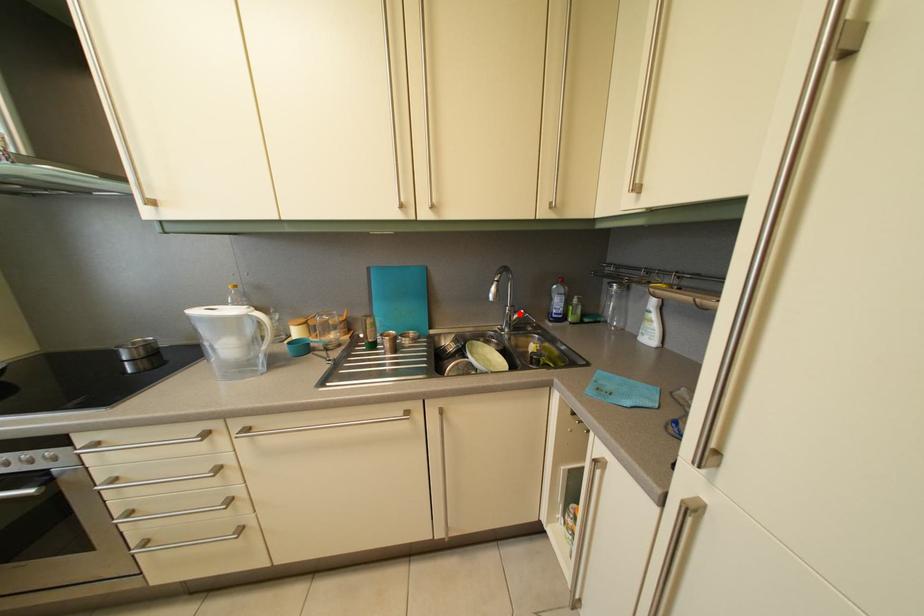
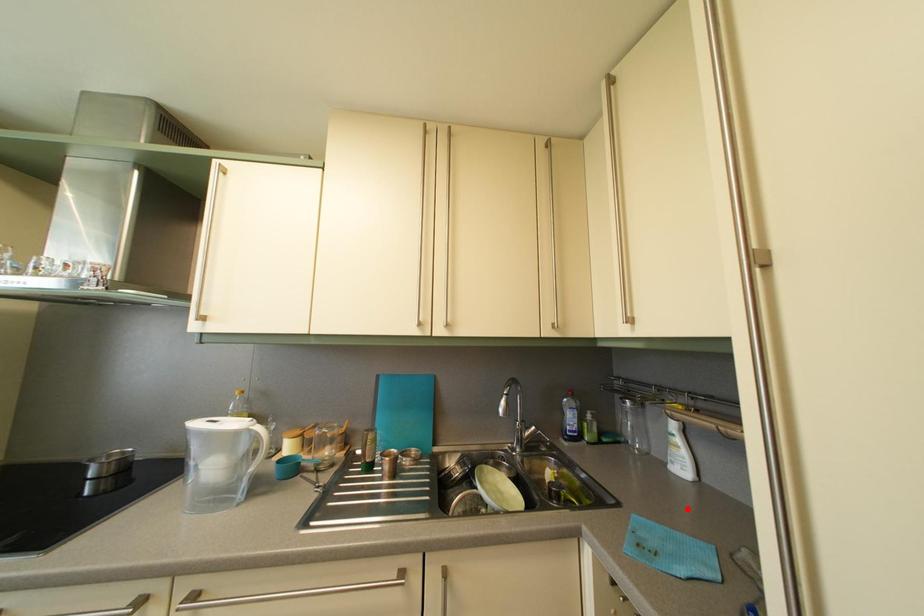
I am providing you with two images of the same scene from different viewpoints. A red point is marked on the first image and another point is marked on the second image. Do the highlighted points in image1 and image2 indicate the same real-world spot?

No